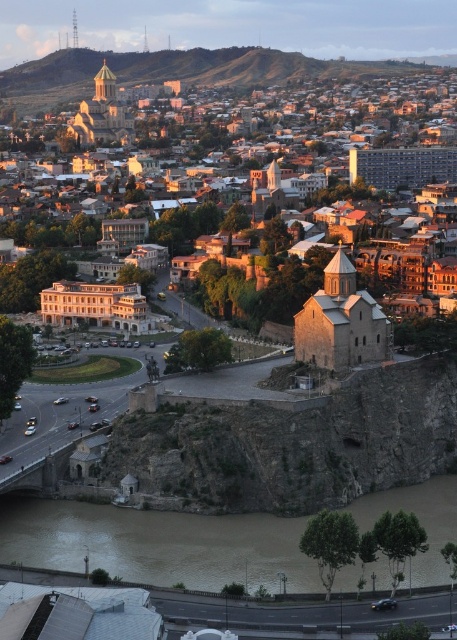
In the scene shown: You are standing in the city and want to cross the river using a small boat. The stone church at center is in your way. Can you see the brown muddy water at lower center from your current position?

Yes, because the stone church at center is further to the viewer than brown muddy water at lower center, so the brown muddy water at lower center is closer to you and visible.

You are standing in the cityscape and want to take a photo. You notice two points in the scene labeled as point 1 at coordinates (415, 259) and point 2 at (157, 540). Which point is closer to your camera position?

Point 2 at (157, 540) is closer to the camera position because it is less further than point 1 at (415, 259).